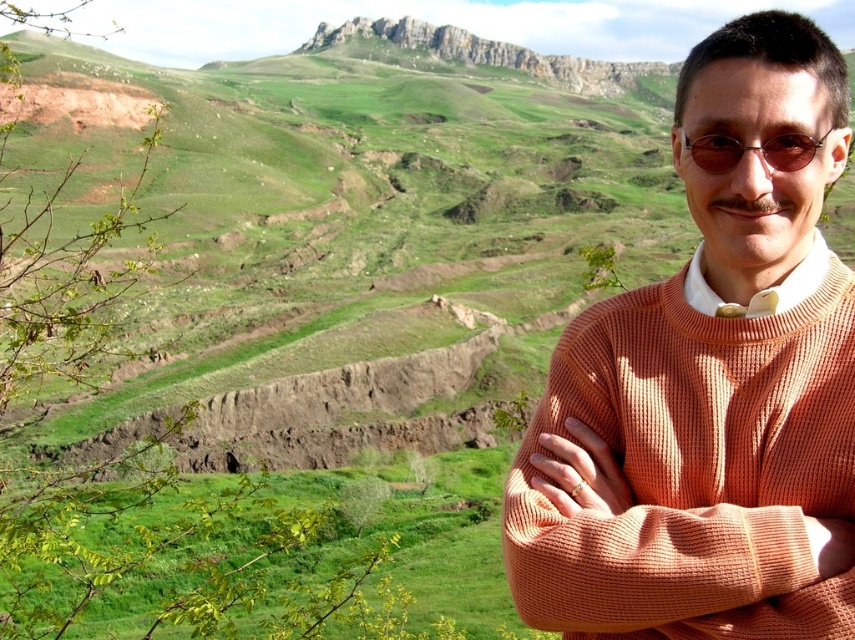
Question: Can you confirm if orange waffle-knit sweater at right is positioned below sunglasses at center?

Choices:
 (A) yes
 (B) no

Answer: (A)

Question: Can you confirm if orange waffle-knit sweater at right is bigger than sunglasses at center?

Choices:
 (A) no
 (B) yes

Answer: (B)

Question: Which point is closer to the camera?

Choices:
 (A) sunglasses at center
 (B) orange waffle-knit sweater at right

Answer: (B)

Question: Which point is closer to the camera?

Choices:
 (A) (759, 154)
 (B) (517, 486)

Answer: (A)

Question: Does orange waffle-knit sweater at right appear on the right side of sunglasses at center?

Choices:
 (A) yes
 (B) no

Answer: (A)

Question: Among these objects, which one is farthest from the camera?

Choices:
 (A) sunglasses at center
 (B) orange waffle-knit sweater at right

Answer: (A)